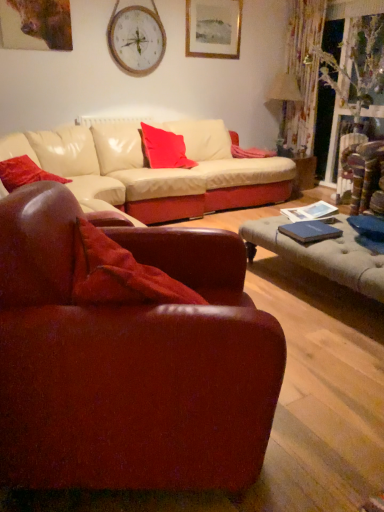
Question: Does point (19, 181) appear closer or farther from the camera than point (132, 47)?

Choices:
 (A) farther
 (B) closer

Answer: (B)

Question: From a real-world perspective, relative to wooden clock at upper center, is matte red pillow at left, which is the 1th pillow from bottom to top, vertically above or below?

Choices:
 (A) above
 (B) below

Answer: (B)

Question: Estimate the real-world distances between objects in this image. Which object is closer to the leather armchair at lower left?

Choices:
 (A) matte beige lampshade at upper right
 (B) wooden clock at upper center
 (C) matte red pillow at center, marked as the second pillow in a front-to-back arrangement
 (D) wooden picture frame at upper center
 (E) matte red pillow at left, the second pillow when ordered from top to bottom

Answer: (E)

Question: Which of these objects is positioned closest to the matte red pillow at left, the 1th pillow when ordered from left to right?

Choices:
 (A) leather armchair at lower left
 (B) matte red pillow at center, which is the 2th pillow in bottom-to-top order
 (C) blue matte book at lower right
 (D) wooden clock at upper center
 (E) wooden picture frame at upper center

Answer: (B)